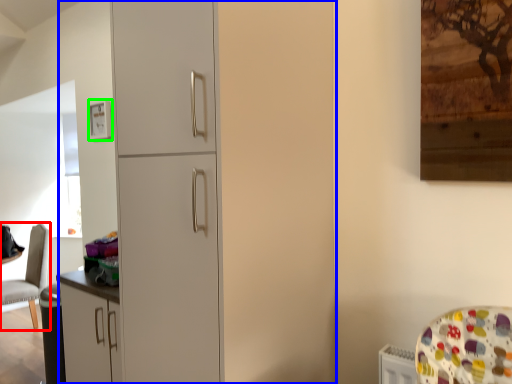
Question: Estimate the real-world distances between objects in this image. Which object is farther from chair (highlighted by a red box), dresser (highlighted by a blue box) or picture frame (highlighted by a green box)?

Choices:
 (A) dresser
 (B) picture frame

Answer: (A)